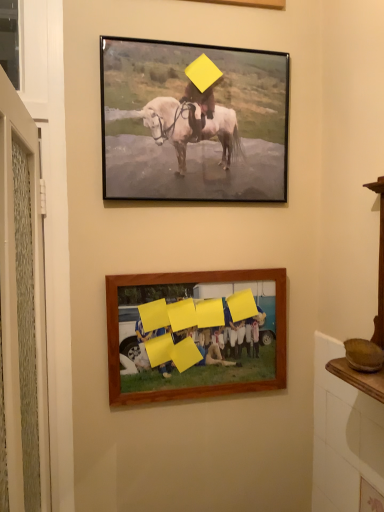
The height and width of the screenshot is (512, 384). What do you see at coordinates (195, 331) in the screenshot?
I see `wooden frame at lower center, positioned as the first picture frame in bottom-to-top order` at bounding box center [195, 331].

This screenshot has width=384, height=512. I want to click on wooden frame at lower center, positioned as the first picture frame in bottom-to-top order, so click(x=195, y=331).

In order to face wooden frame at lower center, positioned as the first picture frame in bottom-to-top order, should I rotate leftwards or rightwards?

Rotate right and turn 1.495 degrees.

Image resolution: width=384 pixels, height=512 pixels. What do you see at coordinates (193, 122) in the screenshot?
I see `matte black frame at upper center, marked as the 1th picture frame in a top-to-bottom arrangement` at bounding box center [193, 122].

You are a GUI agent. You are given a task and a screenshot of the screen. Output one action in this format:
    pyautogui.click(x=<x>, y=<y>)
    Task: Click on the matte black frame at upper center, the 2th picture frame from the bottom
    
    Given the screenshot: What is the action you would take?
    pyautogui.click(x=193, y=122)

At what (x,y) coordinates should I click in order to perform the action: click on wooden frame at lower center, positioned as the first picture frame in bottom-to-top order. Please return your answer as a coordinate pair (x, y). Looking at the image, I should click on (195, 331).

Considering the positions of objects matte black frame at upper center, the 2th picture frame from the bottom, and wooden frame at lower center, positioned as the first picture frame in bottom-to-top order, in the image provided, who is more to the right, matte black frame at upper center, the 2th picture frame from the bottom, or wooden frame at lower center, positioned as the first picture frame in bottom-to-top order,?

From the viewer's perspective, wooden frame at lower center, positioned as the first picture frame in bottom-to-top order, appears more on the right side.

Is matte black frame at upper center, marked as the 1th picture frame in a top-to-bottom arrangement, behind wooden frame at lower center, positioned as the first picture frame in bottom-to-top order?

No, it is in front of wooden frame at lower center, positioned as the first picture frame in bottom-to-top order.

Considering the positions of point (168, 195) and point (232, 392), is point (168, 195) closer or farther from the camera than point (232, 392)?

Point (168, 195).

From the image's perspective, is matte black frame at upper center, marked as the 1th picture frame in a top-to-bottom arrangement, over wooden frame at lower center, positioned as the first picture frame in bottom-to-top order?

Yes, from the image's perspective, matte black frame at upper center, marked as the 1th picture frame in a top-to-bottom arrangement, is above wooden frame at lower center, positioned as the first picture frame in bottom-to-top order.

From a real-world perspective, which is physically above, matte black frame at upper center, the 2th picture frame from the bottom, or wooden frame at lower center, positioned as the second picture frame in top-to-bottom order?

matte black frame at upper center, the 2th picture frame from the bottom.

Considering the sizes of objects matte black frame at upper center, the 2th picture frame from the bottom, and wooden frame at lower center, positioned as the first picture frame in bottom-to-top order, in the image provided, who is wider, matte black frame at upper center, the 2th picture frame from the bottom, or wooden frame at lower center, positioned as the first picture frame in bottom-to-top order,?

With larger width is matte black frame at upper center, the 2th picture frame from the bottom.

In terms of height, does matte black frame at upper center, marked as the 1th picture frame in a top-to-bottom arrangement, look taller or shorter compared to wooden frame at lower center, positioned as the first picture frame in bottom-to-top order?

matte black frame at upper center, marked as the 1th picture frame in a top-to-bottom arrangement, is taller than wooden frame at lower center, positioned as the first picture frame in bottom-to-top order.

Considering the sizes of matte black frame at upper center, the 2th picture frame from the bottom, and wooden frame at lower center, positioned as the second picture frame in top-to-bottom order, in the image, is matte black frame at upper center, the 2th picture frame from the bottom, bigger or smaller than wooden frame at lower center, positioned as the second picture frame in top-to-bottom order,?

matte black frame at upper center, the 2th picture frame from the bottom, is bigger than wooden frame at lower center, positioned as the second picture frame in top-to-bottom order.

Based on the photo, which is correct: matte black frame at upper center, the 2th picture frame from the bottom, is inside wooden frame at lower center, positioned as the second picture frame in top-to-bottom order, or outside of it?

matte black frame at upper center, the 2th picture frame from the bottom, is not inside wooden frame at lower center, positioned as the second picture frame in top-to-bottom order, it's outside.

Is matte black frame at upper center, the 2th picture frame from the bottom, directly adjacent to wooden frame at lower center, positioned as the first picture frame in bottom-to-top order?

matte black frame at upper center, the 2th picture frame from the bottom, is not next to wooden frame at lower center, positioned as the first picture frame in bottom-to-top order, and they're not touching.

Is matte black frame at upper center, the 2th picture frame from the bottom, turned away from wooden frame at lower center, positioned as the first picture frame in bottom-to-top order?

No, matte black frame at upper center, the 2th picture frame from the bottom,'s orientation is not away from wooden frame at lower center, positioned as the first picture frame in bottom-to-top order.

Locate an element on the screen. picture frame above the wooden frame at lower center, positioned as the second picture frame in top-to-bottom order (from the image's perspective) is located at coordinates (193, 122).

Does wooden frame at lower center, positioned as the second picture frame in top-to-bottom order, appear on the right side of matte black frame at upper center, the 2th picture frame from the bottom?

Indeed, wooden frame at lower center, positioned as the second picture frame in top-to-bottom order, is positioned on the right side of matte black frame at upper center, the 2th picture frame from the bottom.

Is wooden frame at lower center, positioned as the first picture frame in bottom-to-top order, in front of or behind matte black frame at upper center, the 2th picture frame from the bottom, in the image?

In the image, wooden frame at lower center, positioned as the first picture frame in bottom-to-top order, appears behind matte black frame at upper center, the 2th picture frame from the bottom.

Does point (169, 304) lie in front of point (110, 186)?

That is False.

From the image's perspective, does wooden frame at lower center, positioned as the second picture frame in top-to-bottom order, appear higher than matte black frame at upper center, marked as the 1th picture frame in a top-to-bottom arrangement?

No, from the image's perspective, wooden frame at lower center, positioned as the second picture frame in top-to-bottom order, is not on top of matte black frame at upper center, marked as the 1th picture frame in a top-to-bottom arrangement.

From a real-world perspective, between wooden frame at lower center, positioned as the first picture frame in bottom-to-top order, and matte black frame at upper center, marked as the 1th picture frame in a top-to-bottom arrangement, who is vertically higher?

matte black frame at upper center, marked as the 1th picture frame in a top-to-bottom arrangement.

Can you confirm if wooden frame at lower center, positioned as the first picture frame in bottom-to-top order, is wider than matte black frame at upper center, the 2th picture frame from the bottom?

No.

Considering the relative sizes of wooden frame at lower center, positioned as the second picture frame in top-to-bottom order, and matte black frame at upper center, the 2th picture frame from the bottom, in the image provided, is wooden frame at lower center, positioned as the second picture frame in top-to-bottom order, taller than matte black frame at upper center, the 2th picture frame from the bottom,?

No.

Can you confirm if wooden frame at lower center, positioned as the first picture frame in bottom-to-top order, is bigger than matte black frame at upper center, marked as the 1th picture frame in a top-to-bottom arrangement?

No, wooden frame at lower center, positioned as the first picture frame in bottom-to-top order, is not bigger than matte black frame at upper center, marked as the 1th picture frame in a top-to-bottom arrangement.

Is wooden frame at lower center, positioned as the second picture frame in top-to-bottom order, outside of matte black frame at upper center, the 2th picture frame from the bottom?

Yes, wooden frame at lower center, positioned as the second picture frame in top-to-bottom order, is located beyond the bounds of matte black frame at upper center, the 2th picture frame from the bottom.

In the scene shown: Is wooden frame at lower center, positioned as the second picture frame in top-to-bottom order, placed right next to matte black frame at upper center, the 2th picture frame from the bottom?

No, wooden frame at lower center, positioned as the second picture frame in top-to-bottom order, is not touching matte black frame at upper center, the 2th picture frame from the bottom.

Is wooden frame at lower center, positioned as the first picture frame in bottom-to-top order, aimed at matte black frame at upper center, the 2th picture frame from the bottom?

No, wooden frame at lower center, positioned as the first picture frame in bottom-to-top order, does not turn towards matte black frame at upper center, the 2th picture frame from the bottom.

Could you measure the distance between wooden frame at lower center, positioned as the first picture frame in bottom-to-top order, and matte black frame at upper center, the 2th picture frame from the bottom?

15.65 inches.

The width and height of the screenshot is (384, 512). In order to click on picture frame located in front of the wooden frame at lower center, positioned as the first picture frame in bottom-to-top order in this screenshot , I will do click(193, 122).

You are a GUI agent. You are given a task and a screenshot of the screen. Output one action in this format:
    pyautogui.click(x=<x>, y=<y>)
    Task: Click on the picture frame above the wooden frame at lower center, positioned as the first picture frame in bottom-to-top order (from the image's perspective)
    
    Given the screenshot: What is the action you would take?
    pyautogui.click(x=193, y=122)

The height and width of the screenshot is (512, 384). Identify the location of picture frame that appears on the left of wooden frame at lower center, positioned as the second picture frame in top-to-bottom order. (193, 122).